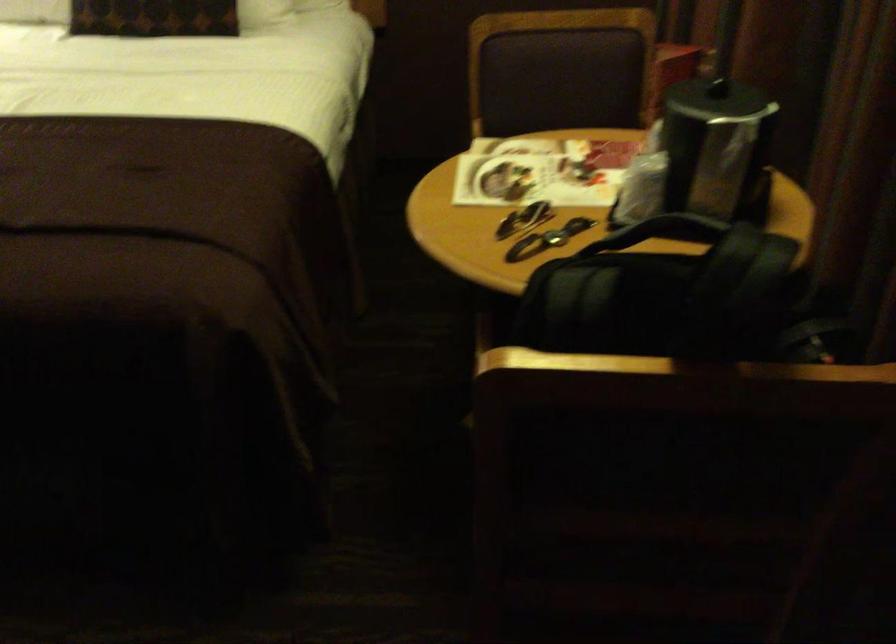
Identify the location of steel coffee pot. The image size is (896, 644). (717, 149).